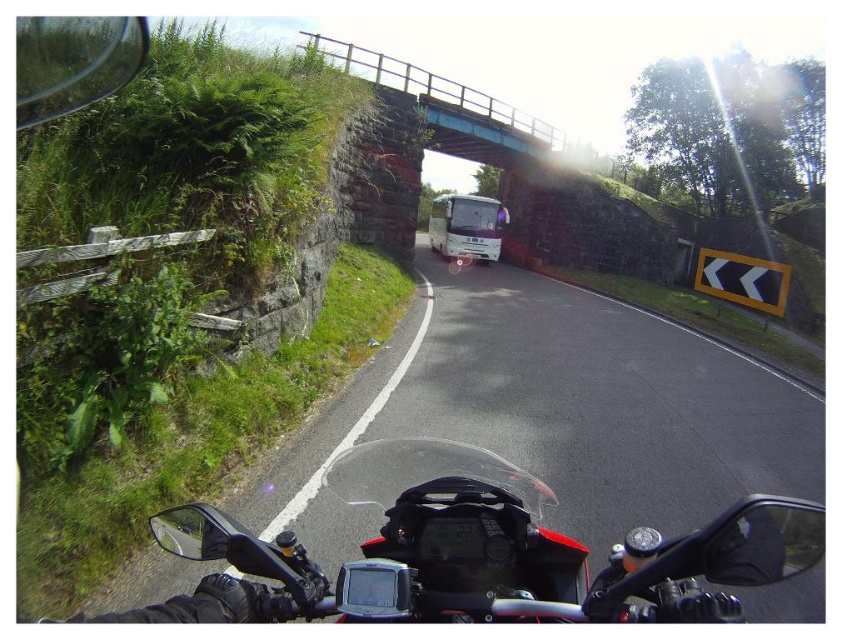
You are riding a motorcycle and see the blue painted concrete bridge at upper center and the white glossy bus at center. Which object is positioned higher in the scene?

The blue painted concrete bridge at upper center is positioned higher than the white glossy bus at center in the scene.

You are a motorcyclist approaching a curve on the road. You see the blue painted concrete bridge at upper center and the white glossy bus at center. Which object is located to the left of the other?

The blue painted concrete bridge at upper center is positioned on the left side of white glossy bus at center.

Based on the photo, you are riding a motorcycle and want to know how far the point at coordinates point (x=386, y=84) is from your current position. Can you determine the distance?

The distance of point (x=386, y=84) from camera is 62.05 feet.